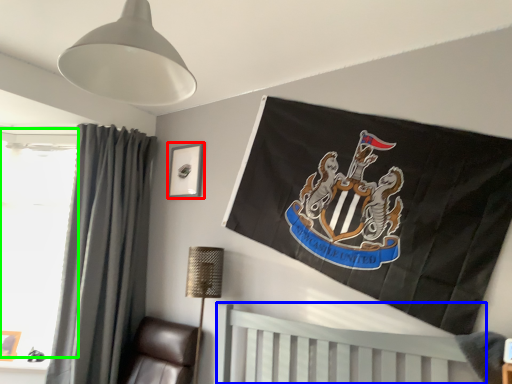
Question: Which is nearer to the picture frame (highlighted by a red box)? furniture (highlighted by a blue box) or window screen (highlighted by a green box).

Choices:
 (A) furniture
 (B) window screen

Answer: (B)